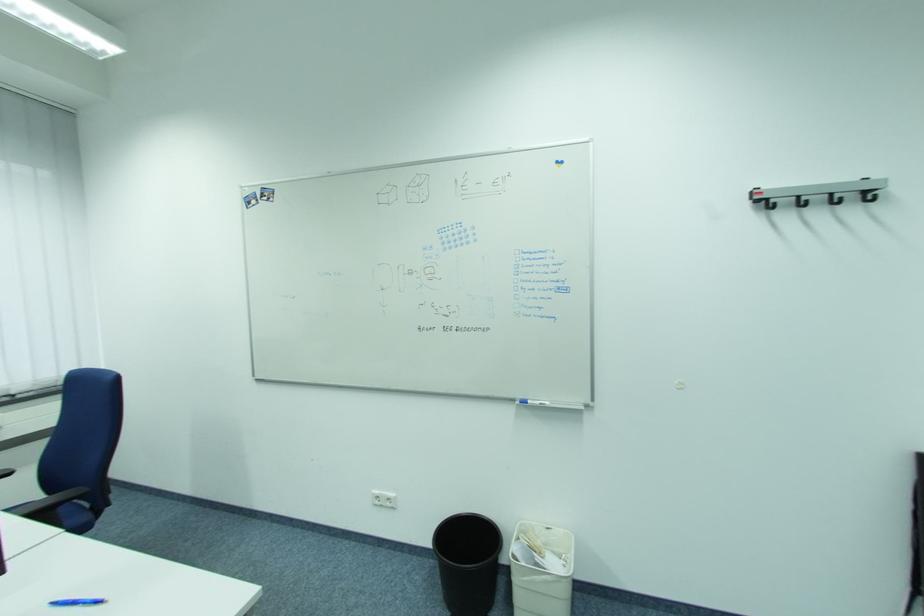
In order to click on black chair armrest in this screenshot , I will do `click(49, 503)`.